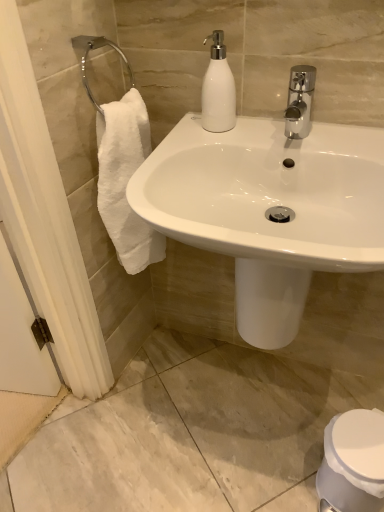
You are a GUI agent. You are given a task and a screenshot of the screen. Output one action in this format:
    pyautogui.click(x=<x>, y=<y>)
    Task: Click on the free space above white glossy toilet at lower right (from a real-world perspective)
    
    Given the screenshot: What is the action you would take?
    pyautogui.click(x=360, y=439)